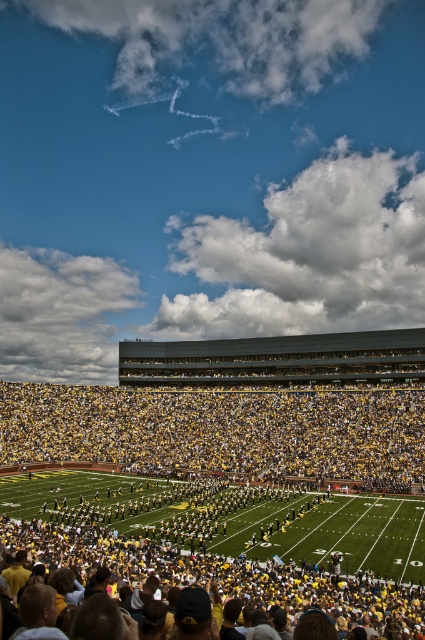
Is point (57, 532) farther from camera compared to point (214, 451)?

No.

Is yellow-green uniformed band at center to the left of yellow/yellowish fabric crowd at center from the viewer's perspective?

No, yellow-green uniformed band at center is not to the left of yellow/yellowish fabric crowd at center.

Where is `yellow-green uniformed band at center`? This screenshot has width=425, height=640. yellow-green uniformed band at center is located at coordinates (226, 496).